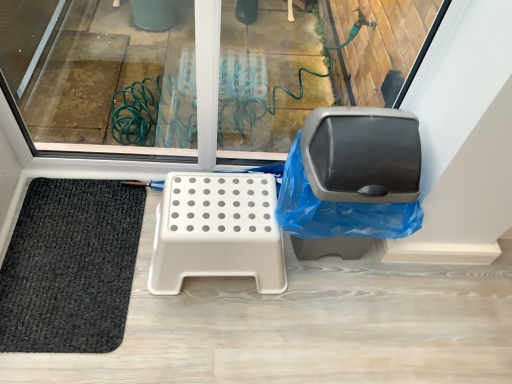
Measure the distance between point (72, 259) and camera.

A distance of 4.37 feet exists between point (72, 259) and camera.

This screenshot has height=384, width=512. I want to click on black woven mat at lower left, so click(x=70, y=266).

Is beige plastic step stool at center bigger or smaller than matte gray swivel chair at right?

In the image, beige plastic step stool at center appears to be smaller than matte gray swivel chair at right.

How far apart are beige plastic step stool at center and matte gray swivel chair at right?

They are 12.35 inches apart.

Is beige plastic step stool at center facing towards matte gray swivel chair at right?

No, beige plastic step stool at center is not oriented towards matte gray swivel chair at right.

Is beige plastic step stool at center situated inside black woven mat at lower left or outside?

beige plastic step stool at center lies outside black woven mat at lower left.

Does beige plastic step stool at center have a greater height compared to black woven mat at lower left?

Indeed, beige plastic step stool at center has a greater height compared to black woven mat at lower left.

Identify the location of mat on the left of the beige plastic step stool at center. (70, 266).

Would you say beige plastic step stool at center is a long distance from black woven mat at lower left?

No, beige plastic step stool at center is not far from black woven mat at lower left.

Consider the image. Is black woven mat at lower left at the back of matte gray swivel chair at right?

No, matte gray swivel chair at right is not facing the opposite direction of black woven mat at lower left.

Which is behind, matte gray swivel chair at right or black woven mat at lower left?

Positioned behind is black woven mat at lower left.

From the image's perspective, which one is positioned higher, matte gray swivel chair at right or black woven mat at lower left?

matte gray swivel chair at right, from the image's perspective.

Can you tell me how much matte gray swivel chair at right and black woven mat at lower left differ in facing direction?

matte gray swivel chair at right and black woven mat at lower left are facing 87.8 degrees away from each other.

Based on their positions, is black woven mat at lower left located to the left or right of matte gray swivel chair at right?

black woven mat at lower left is positioned on matte gray swivel chair at right's left side.

Are black woven mat at lower left and matte gray swivel chair at right located far from each other?

No, there isn't a large distance between black woven mat at lower left and matte gray swivel chair at right.

From a real-world perspective, which object rests below the other?

From a 3D spatial view, black woven mat at lower left is below.

Considering the relative positions of black woven mat at lower left and beige plastic step stool at center in the image provided, is black woven mat at lower left to the right of beige plastic step stool at center from the viewer's perspective?

In fact, black woven mat at lower left is to the left of beige plastic step stool at center.

Locate an element on the screen. The width and height of the screenshot is (512, 384). mat directly beneath the beige plastic step stool at center (from a real-world perspective) is located at coordinates (70, 266).

From a real-world perspective, is black woven mat at lower left below beige plastic step stool at center?

Yes, from a real-world perspective, black woven mat at lower left is under beige plastic step stool at center.

Can you tell me how much black woven mat at lower left and beige plastic step stool at center differ in facing direction?

87.8 degrees.

Is matte gray swivel chair at right bigger or smaller than beige plastic step stool at center?

Considering their sizes, matte gray swivel chair at right takes up more space than beige plastic step stool at center.

From a real-world perspective, is matte gray swivel chair at right physically below beige plastic step stool at center?

No.

In the scene shown: Is matte gray swivel chair at right completely or partially outside of beige plastic step stool at center?

That's correct, matte gray swivel chair at right is outside of beige plastic step stool at center.

Is matte gray swivel chair at right far from beige plastic step stool at center?

matte gray swivel chair at right is actually quite close to beige plastic step stool at center.

The height and width of the screenshot is (384, 512). I want to click on swivel chair above the beige plastic step stool at center (from the image's perspective), so click(362, 155).

This screenshot has height=384, width=512. I want to click on mat below the beige plastic step stool at center (from a real-world perspective), so click(70, 266).

Looking at the image, which one is located further to beige plastic step stool at center, black woven mat at lower left or matte gray swivel chair at right?

black woven mat at lower left lies further to beige plastic step stool at center than the other object.

Estimate the real-world distances between objects in this image. Which object is closer to matte gray swivel chair at right, black woven mat at lower left or beige plastic step stool at center?

beige plastic step stool at center lies closer to matte gray swivel chair at right than the other object.

From the picture: Which object lies nearer to the anchor point black woven mat at lower left, matte gray swivel chair at right or beige plastic step stool at center?

beige plastic step stool at center.

Estimate the real-world distances between objects in this image. Which object is closer to beige plastic step stool at center, matte gray swivel chair at right or black woven mat at lower left?

Based on the image, matte gray swivel chair at right appears to be nearer to beige plastic step stool at center.

Based on their spatial positions, is beige plastic step stool at center or black woven mat at lower left further from matte gray swivel chair at right?

black woven mat at lower left is further to matte gray swivel chair at right.

Looking at the image, which one is located closer to black woven mat at lower left, beige plastic step stool at center or matte gray swivel chair at right?

Based on the image, beige plastic step stool at center appears to be nearer to black woven mat at lower left.

This screenshot has width=512, height=384. In order to click on furniture situated between black woven mat at lower left and matte gray swivel chair at right from left to right in this screenshot , I will do (217, 231).